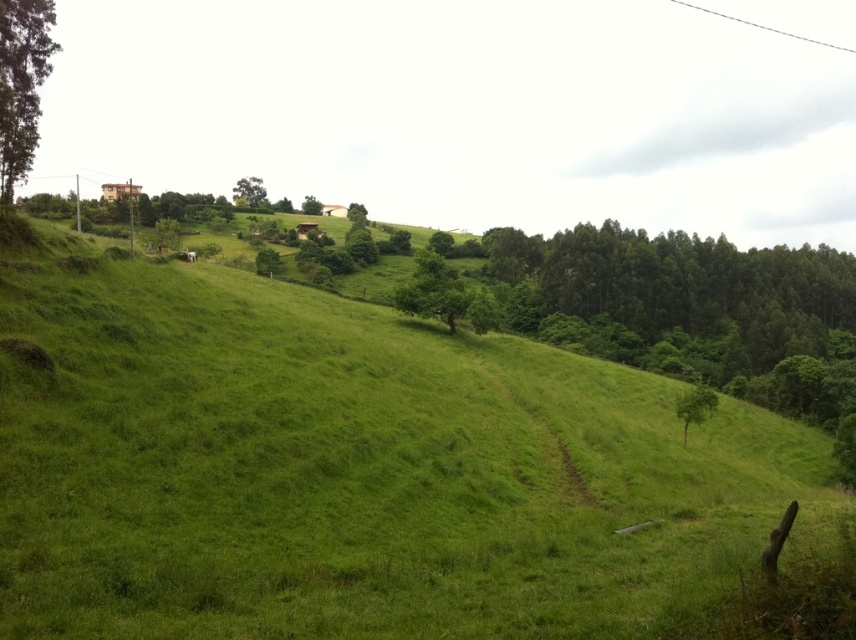
You are standing at the center of the image and want to walk to the green leafy tree at left. Which direction should you face to head directly towards it?

The green leafy tree at left is located at point (21, 84) in 2D coordinates, so you should face towards the left direction to head directly towards it.

Based on the photo, you are standing on the dirt path and looking towards the green leafy tree at left and the green leafy tree at right. Which tree is closer to you?

The green leafy tree at left is closer to you because it is in front of the green leafy tree at right.